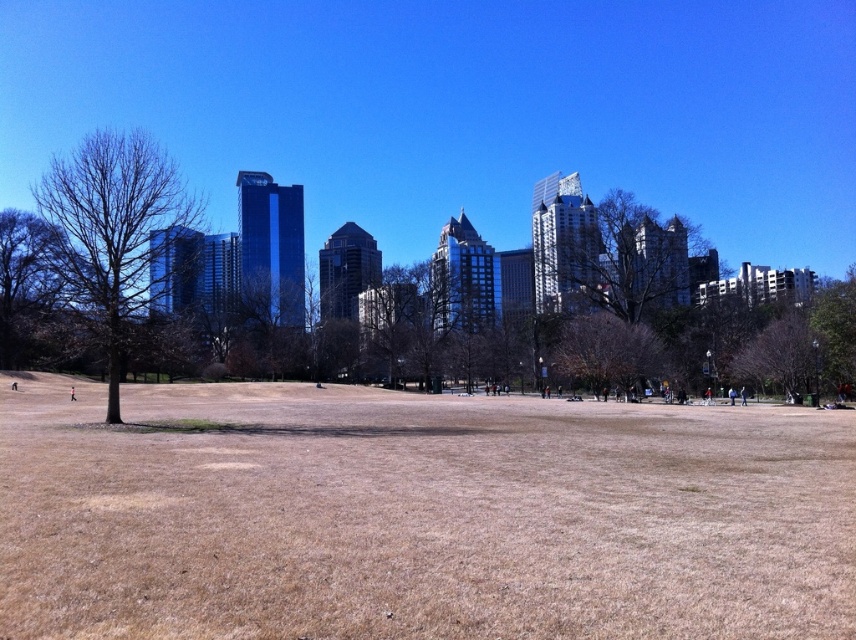
Question: Which object is farther from the camera taking this photo?

Choices:
 (A) brown textured tree at lower right
 (B) green leafy tree at right

Answer: (A)

Question: Can you confirm if brown dry grass at center is positioned to the left of bare brown tree at left?

Choices:
 (A) yes
 (B) no

Answer: (B)

Question: Is green leafy tree at center positioned behind brown textured tree at lower right?

Choices:
 (A) yes
 (B) no

Answer: (A)

Question: Estimate the real-world distances between objects in this image. Which object is farther from the bare brown tree at left?

Choices:
 (A) brown textured tree at lower right
 (B) green leafy tree at right

Answer: (B)

Question: Which of the following is the farthest from the observer?

Choices:
 (A) (797, 310)
 (B) (843, 364)
 (C) (809, 588)
 (D) (642, 266)

Answer: (D)

Question: Does brown dry grass at center appear on the left side of green leafy tree at center?

Choices:
 (A) yes
 (B) no

Answer: (A)